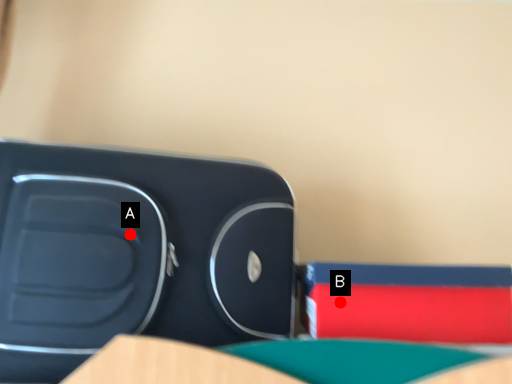
Question: Two points are circled on the image, labeled by A and B beside each circle. Which point appears farthest from the camera in this image?

Choices:
 (A) A is further
 (B) B is further

Answer: (B)